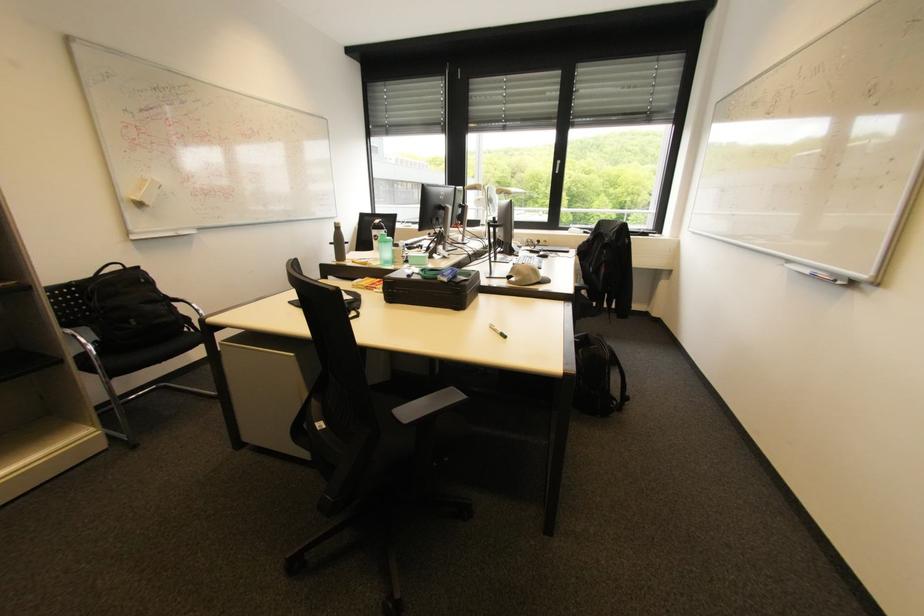
Locate an element on the screen. chair sitting surface is located at coordinates (149, 355).